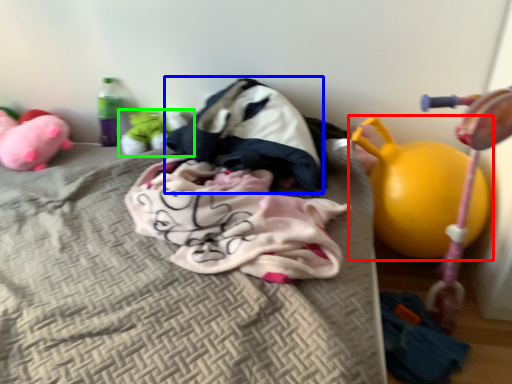
Question: Which object is positioned closest to toy (highlighted by a red box)? Select from sleeping bag (highlighted by a blue box) and toy (highlighted by a green box).

Choices:
 (A) sleeping bag
 (B) toy

Answer: (A)